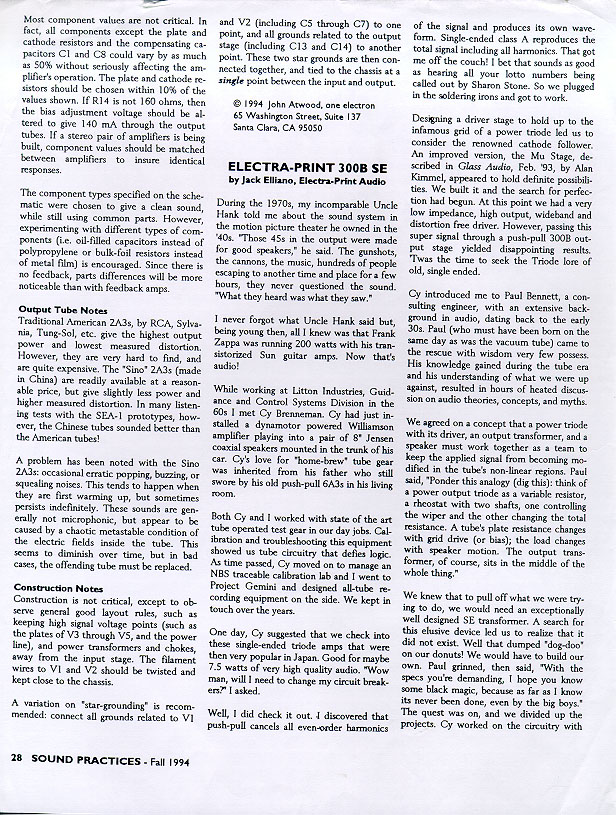
Identify the location of column. (95, 689), (299, 689), (469, 693).